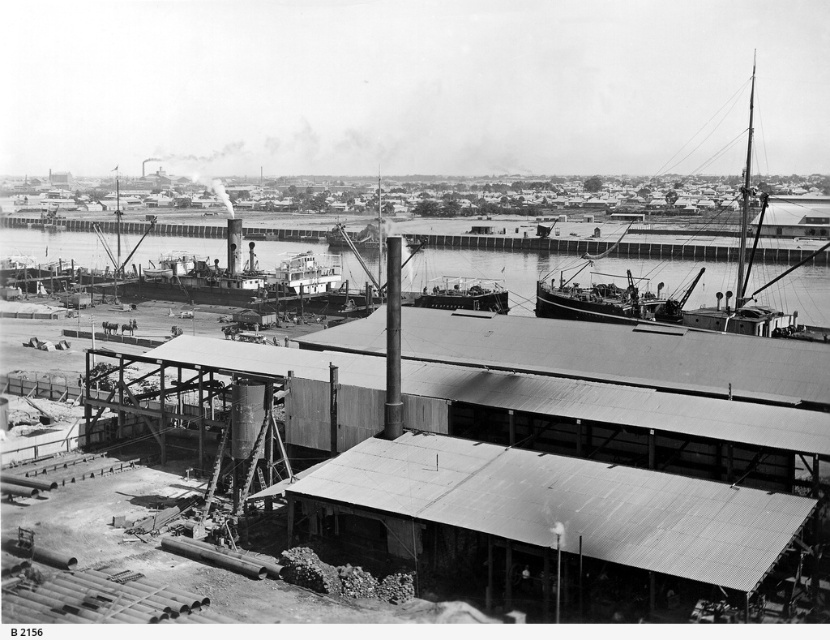
In the scene shown: Which is above, rusty metal ship at right or smooth metal boat at center?

Positioned higher is rusty metal ship at right.

Who is more distant from viewer, (750, 305) or (433, 291)?

Point (433, 291)

Identify the location of rusty metal ship at right. The height and width of the screenshot is (640, 830). (686, 285).